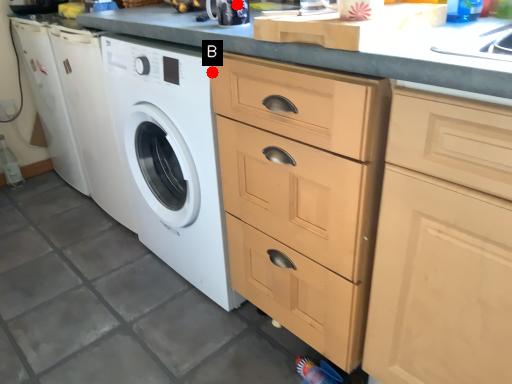
Question: Two points are circled on the image, labeled by A and B beside each circle. Which point is farther to the camera?

Choices:
 (A) A is further
 (B) B is further

Answer: (A)